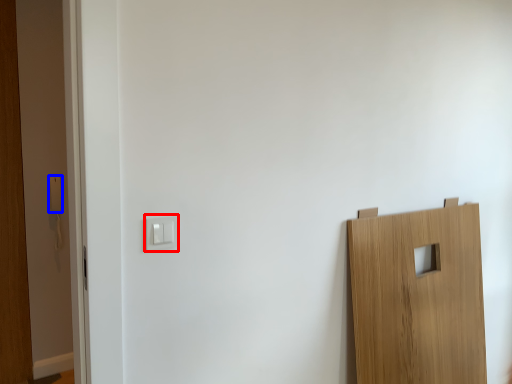
Question: Among these objects, which one is farthest to the camera, light switch (highlighted by a red box) or light switch (highlighted by a blue box)?

Choices:
 (A) light switch
 (B) light switch

Answer: (B)